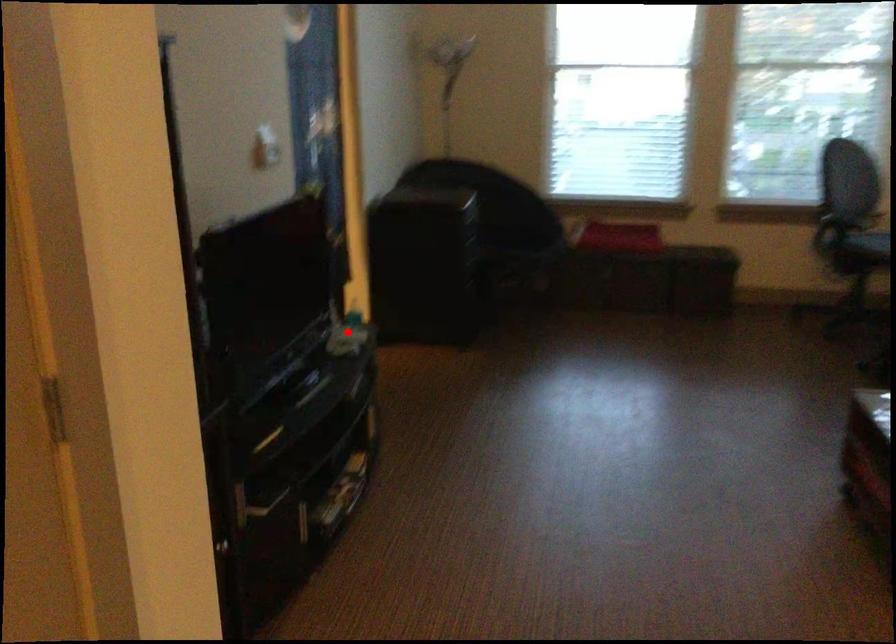
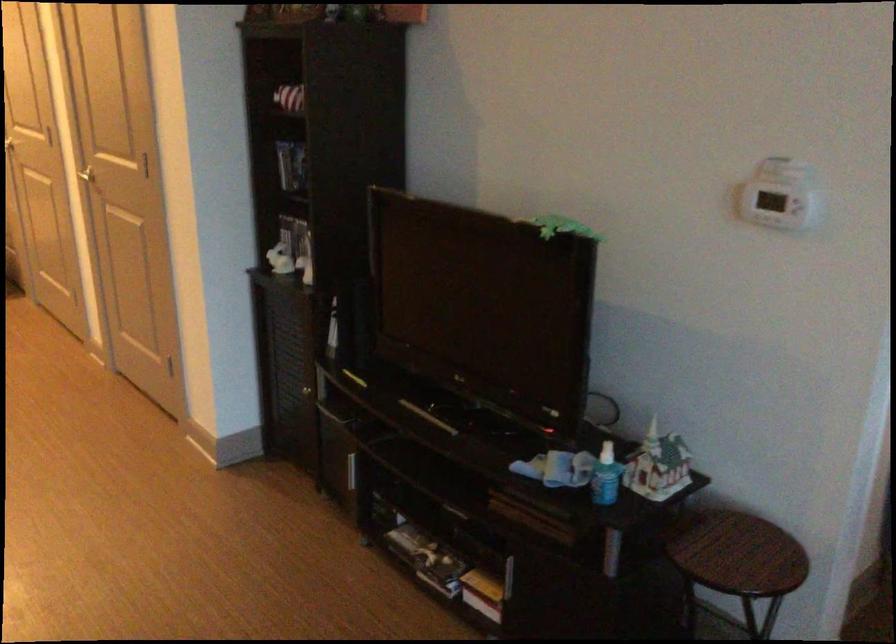
Question: I am providing you with two images of the same scene from different viewpoints. Given a red point in image1, look at the same physical point in image2. Is it:

Choices:
 (A) Closer to the viewpoint
 (B) Farther from the viewpoint

Answer: (A)